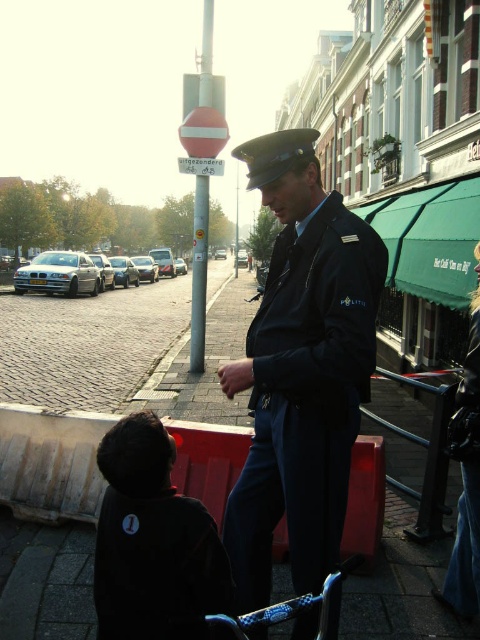
Question: Can you confirm if black matte jacket at lower left is thinner than cobblestone pavement at lower left?

Choices:
 (A) no
 (B) yes

Answer: (B)

Question: Estimate the real-world distances between objects in this image. Which object is closer to the black matte jacket at lower left?

Choices:
 (A) cobblestone pavement at lower left
 (B) dark blue fabric uniform at center
 (C) dark blue uniform at center

Answer: (C)

Question: Does dark blue uniform at center have a smaller size compared to dark blue fabric uniform at center?

Choices:
 (A) yes
 (B) no

Answer: (B)

Question: Does cobblestone pavement at lower left appear on the right side of dark blue fabric uniform at center?

Choices:
 (A) yes
 (B) no

Answer: (B)

Question: Which object is positioned farthest from the dark blue uniform at center?

Choices:
 (A) black matte jacket at lower left
 (B) cobblestone pavement at lower left

Answer: (B)

Question: Based on their relative distances, which object is nearer to the cobblestone pavement at lower left?

Choices:
 (A) black matte jacket at lower left
 (B) dark blue uniform at center

Answer: (A)